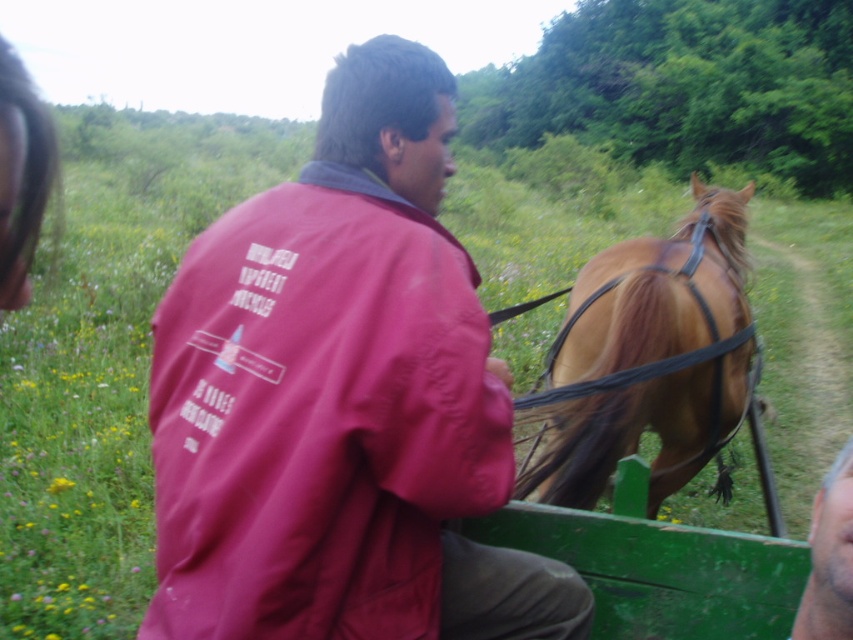
You are standing in front of the image and want to touch the two points shown in the scene. Which point, point (x=440, y=412) or point (x=701, y=381), is closer to you?

Point (x=440, y=412) is closer to the viewer than point (x=701, y=381).

You are a photographer trying to capture both the matte red jacket at center and the shiny brown horse at right in a single frame. Given their sizes, which object should you focus on first to ensure both are in the frame?

The matte red jacket at center is smaller in size compared to the shiny brown horse at right. To ensure both are in the frame, focus on positioning the larger shiny brown horse at right first, then adjust to include the smaller matte red jacket at center.